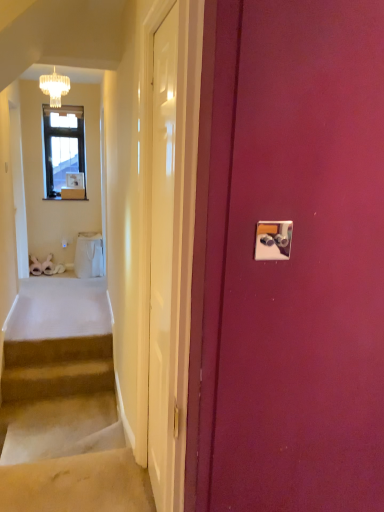
Locate an element on the screen. vacant region below crystal glass chandelier at upper left (from a real-world perspective) is located at coordinates (62, 300).